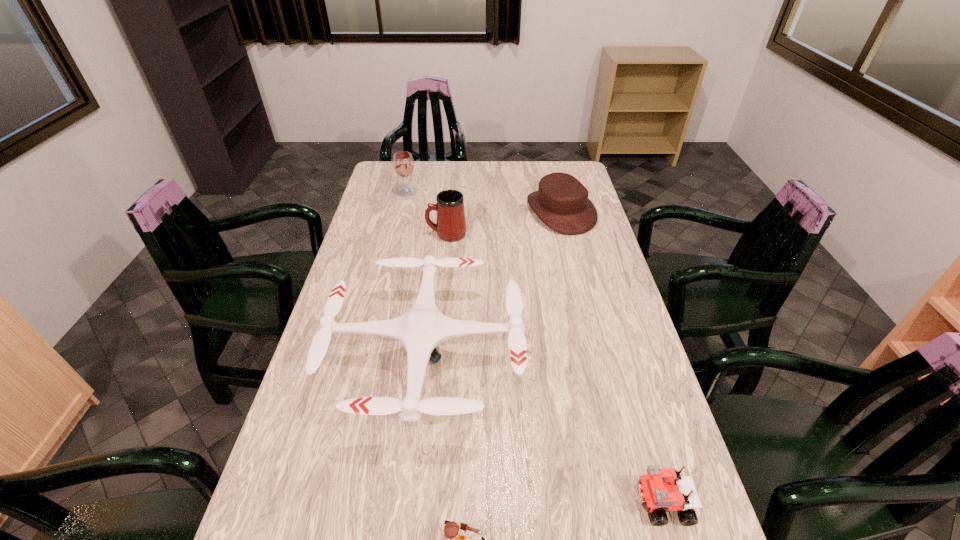
I want to click on wineglass, so click(403, 163).

You are a GUI agent. You are given a task and a screenshot of the screen. Output one action in this format:
    pyautogui.click(x=<x>, y=<y>)
    Task: Click on the mug
    
    Given the screenshot: What is the action you would take?
    pyautogui.click(x=450, y=226)

The width and height of the screenshot is (960, 540). What are the coordinates of `the third nearest object` in the screenshot? It's located at (421, 329).

Where is `hat`? The height and width of the screenshot is (540, 960). hat is located at coordinates (561, 202).

Where is `the right Lego`? The image size is (960, 540). the right Lego is located at coordinates (660, 488).

You are a GUI agent. You are given a task and a screenshot of the screen. Output one action in this format:
    pyautogui.click(x=<x>, y=<y>)
    Task: Click on the vacant space positioned on the left of the wineglass
    
    Given the screenshot: What is the action you would take?
    pyautogui.click(x=382, y=192)

Locate an element on the screen. This screenshot has width=960, height=540. free point located 0.080m on the side of the mug with the handle is located at coordinates (405, 234).

Identify the location of vacant space located on the side of the mug with the handle. The height and width of the screenshot is (540, 960). (356, 234).

Image resolution: width=960 pixels, height=540 pixels. I want to click on vacant area situated on the side of the mug with the handle, so click(370, 234).

What are the coordinates of `vacant region located 0.050m with the camera attached at the bottom of the third nearest object` in the screenshot? It's located at (540, 353).